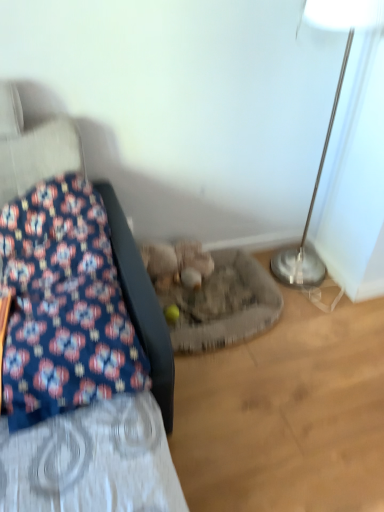
Locate an element on the screen. This screenshot has width=384, height=512. vacant area situated below silver metallic floor lamp at right (from a real-world perspective) is located at coordinates (293, 281).